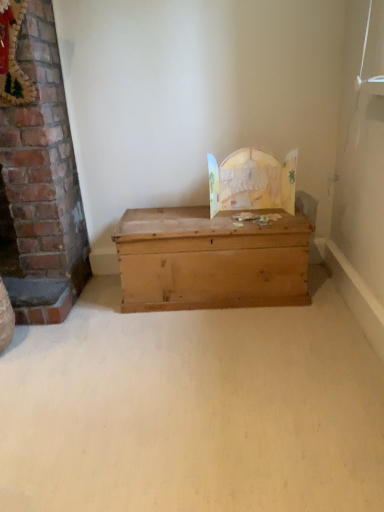
Question: From a real-world perspective, relative to brick fireplace at left, is natural wood trunk at center vertically above or below?

Choices:
 (A) above
 (B) below

Answer: (B)

Question: Is natural wood trunk at center to the left or to the right of brick fireplace at left in the image?

Choices:
 (A) left
 (B) right

Answer: (B)

Question: Is point (259, 240) positioned closer to the camera than point (43, 294)?

Choices:
 (A) farther
 (B) closer

Answer: (B)

Question: From their relative heights in the image, would you say brick fireplace at left is taller or shorter than natural wood trunk at center?

Choices:
 (A) tall
 (B) short

Answer: (A)

Question: Relative to natural wood trunk at center, is brick fireplace at left in front or behind?

Choices:
 (A) behind
 (B) front

Answer: (B)

Question: Would you say brick fireplace at left is inside or outside natural wood trunk at center?

Choices:
 (A) outside
 (B) inside

Answer: (A)

Question: In terms of width, does brick fireplace at left look wider or thinner when compared to natural wood trunk at center?

Choices:
 (A) thin
 (B) wide

Answer: (A)